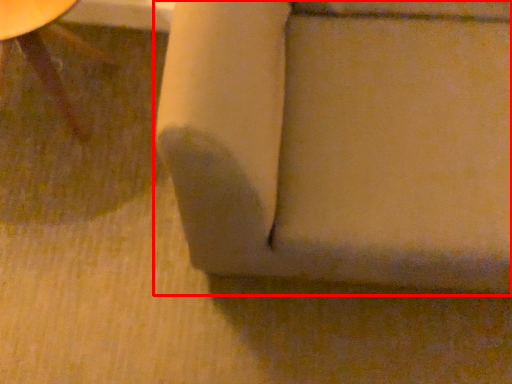
Question: In this image, where is furniture (annotated by the red box) located relative to furniture?

Choices:
 (A) right
 (B) left

Answer: (A)